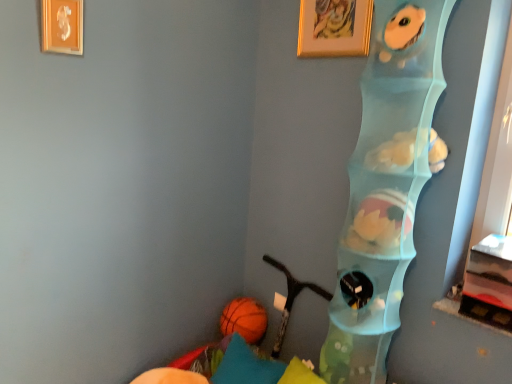
Question: From their relative heights in the image, would you say white plush toy at center, the 2th animal positioned from the top, is taller or shorter than fluffy blue plush toy at upper right, the second animal positioned from the bottom?

Choices:
 (A) short
 (B) tall

Answer: (A)

Question: Do you think white plush toy at center, the 1th animal positioned from the bottom, is within fluffy blue plush toy at upper right, arranged as the first animal when viewed from the top, or outside of it?

Choices:
 (A) outside
 (B) inside

Answer: (A)

Question: Which object is the farthest from the gold-framed picture at upper center, which is the first picture frame in back-to-front order?

Choices:
 (A) white plush toy at center, the 2th animal positioned from the top
 (B) fluffy blue plush toy at upper right, the second animal positioned from the bottom
 (C) gold metallic picture frame at upper left, the 1th picture frame in the left-to-right sequence
 (D) translucent plastic shelf at right
 (E) orange rubber ball at lower left

Answer: (E)

Question: Which is nearer to the teal fabric pillow at lower left?

Choices:
 (A) translucent plastic shelf at right
 (B) gold metallic picture frame at upper left, positioned as the 1th picture frame in front-to-back order
 (C) white plush toy at center, the 2th animal positioned from the top
 (D) fluffy blue plush toy at upper right, the second animal positioned from the bottom
 (E) gold-framed picture at upper center, placed as the 2th picture frame when sorted from front to back

Answer: (A)